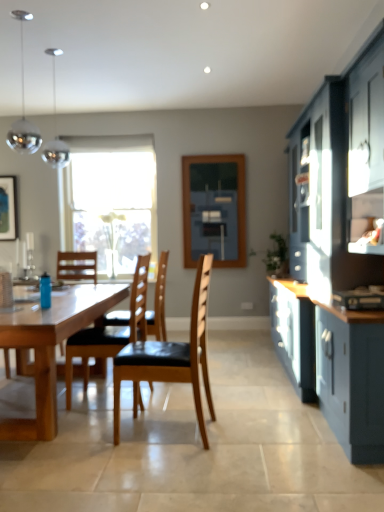
Image resolution: width=384 pixels, height=512 pixels. I want to click on empty space that is to the right of brown leather chair at center, positioned as the 3th chair in back-to-front order, so click(241, 432).